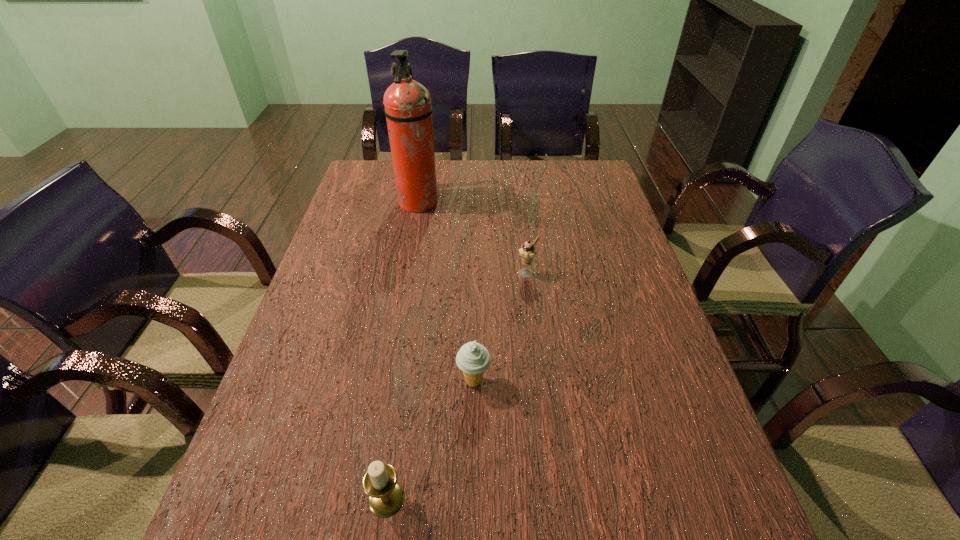
Locate an element on the screen. Image resolution: width=960 pixels, height=540 pixels. the tallest object is located at coordinates (408, 110).

This screenshot has height=540, width=960. Identify the location of fire extinguisher. (408, 110).

You are a GUI agent. You are given a task and a screenshot of the screen. Output one action in this format:
    pyautogui.click(x=<x>, y=<y>)
    Task: Click on the second farthest object
    The height and width of the screenshot is (540, 960).
    Given the screenshot: What is the action you would take?
    pyautogui.click(x=527, y=252)

Identify the location of the right icecream. (527, 252).

Where is `the second nearest object`? This screenshot has width=960, height=540. the second nearest object is located at coordinates (473, 359).

Find the location of `the nearer icecream`. the nearer icecream is located at coordinates (473, 359).

Identify the location of the nearest object. (385, 495).

Locate an element on the screen. vacant region located at the nozzle of the tallest object is located at coordinates (507, 203).

The height and width of the screenshot is (540, 960). Find the location of `free space located on the front of the rightmost object`. free space located on the front of the rightmost object is located at coordinates (538, 364).

I want to click on free point located on the right of the left icecream, so click(567, 381).